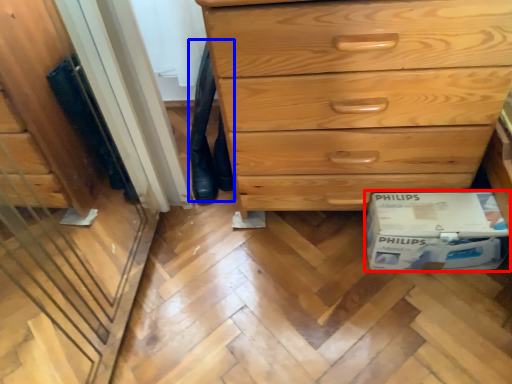
Question: Among these objects, which one is nearest to the camera, cardboard box (highlighted by a red box) or jeans (highlighted by a blue box)?

Choices:
 (A) cardboard box
 (B) jeans

Answer: (A)